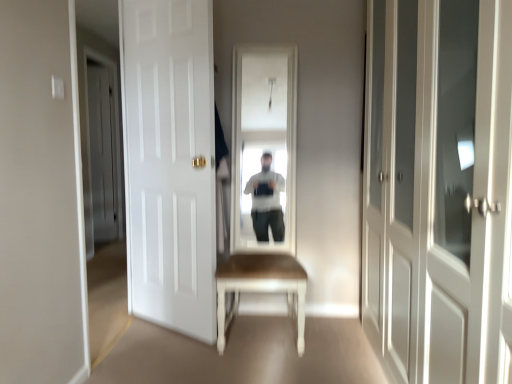
Question: Considering the relative positions of light brown wooden table at center and white matte door at left, which is counted as the first door, starting from the back, in the image provided, is light brown wooden table at center to the left or to the right of white matte door at left, which is counted as the first door, starting from the back,?

Choices:
 (A) left
 (B) right

Answer: (B)

Question: Considering their positions, is light brown wooden table at center located in front of or behind white matte door at left, placed as the 3th door when sorted from front to back?

Choices:
 (A) behind
 (B) front

Answer: (B)

Question: Which of these objects is positioned farthest from the white matte door at left, placed as the 3th door when sorted from front to back?

Choices:
 (A) white glossy cabinet at right, acting as the 1th door starting from the front
 (B) white matte door at center, the second door viewed from the front
 (C) light brown wooden table at center

Answer: (A)

Question: Based on their relative distances, which object is nearer to the light brown wooden table at center?

Choices:
 (A) white matte door at left, acting as the 3th door starting from the right
 (B) white glossy cabinet at right, placed as the first door when sorted from right to left
 (C) white matte door at center, which is counted as the 2th door, starting from the back

Answer: (C)